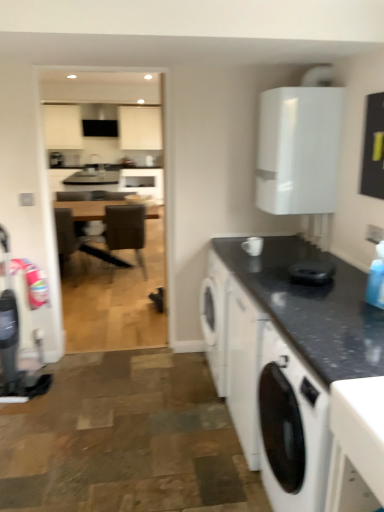
Question: Considering the relative sizes of brown wooden table at center and white glossy cabinet at upper right in the image provided, is brown wooden table at center thinner than white glossy cabinet at upper right?

Choices:
 (A) no
 (B) yes

Answer: (A)

Question: Would you consider brown wooden table at center to be distant from white glossy cabinet at upper right?

Choices:
 (A) no
 (B) yes

Answer: (B)

Question: Considering the relative positions of brown wooden table at center and white glossy cabinet at upper right in the image provided, is brown wooden table at center behind white glossy cabinet at upper right?

Choices:
 (A) yes
 (B) no

Answer: (A)

Question: Can you confirm if brown wooden table at center is taller than white glossy cabinet at upper right?

Choices:
 (A) yes
 (B) no

Answer: (A)

Question: Can we say brown wooden table at center lies outside white glossy cabinet at upper right?

Choices:
 (A) yes
 (B) no

Answer: (A)

Question: Is brown wooden table at center oriented towards white glossy cabinet at upper right?

Choices:
 (A) yes
 (B) no

Answer: (B)

Question: Is brown leather chair at center taller than white matte washing machine at lower right?

Choices:
 (A) yes
 (B) no

Answer: (A)

Question: Is the surface of brown leather chair at center in direct contact with white matte washing machine at lower right?

Choices:
 (A) yes
 (B) no

Answer: (B)

Question: Can you confirm if brown leather chair at center is bigger than white matte washing machine at lower right?

Choices:
 (A) yes
 (B) no

Answer: (B)

Question: From the image's perspective, is brown leather chair at center below white matte washing machine at lower right?

Choices:
 (A) no
 (B) yes

Answer: (A)

Question: Could you tell me if brown leather chair at center is facing white matte washing machine at lower right?

Choices:
 (A) no
 (B) yes

Answer: (A)

Question: From the image's perspective, is brown leather chair at center on white matte washing machine at lower right?

Choices:
 (A) yes
 (B) no

Answer: (A)

Question: From the image's perspective, would you say brown wooden table at center is shown under black granite countertop at lower right?

Choices:
 (A) no
 (B) yes

Answer: (A)